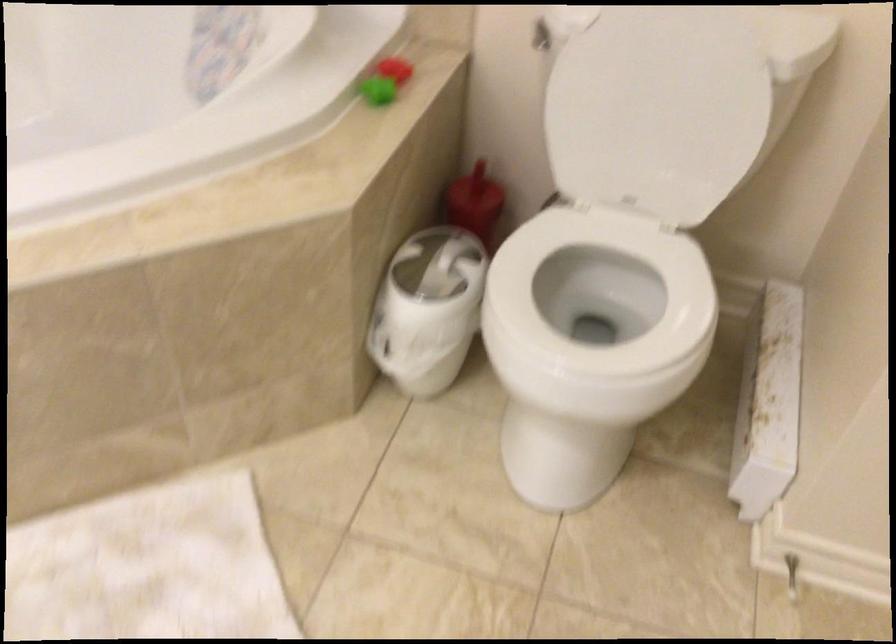
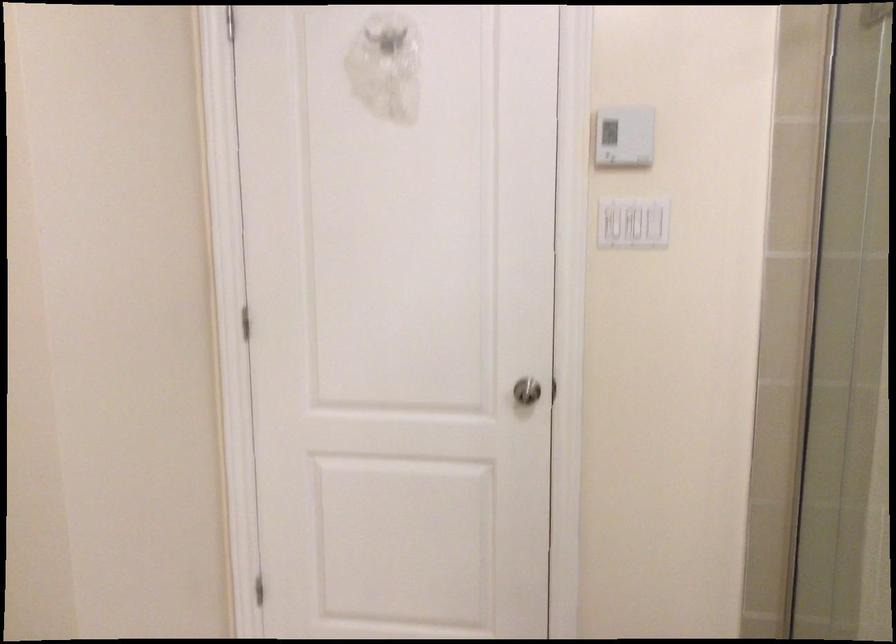
The images are taken continuously from a first-person perspective. In which direction is your viewpoint rotating?

The rotation direction of the camera is right-down.